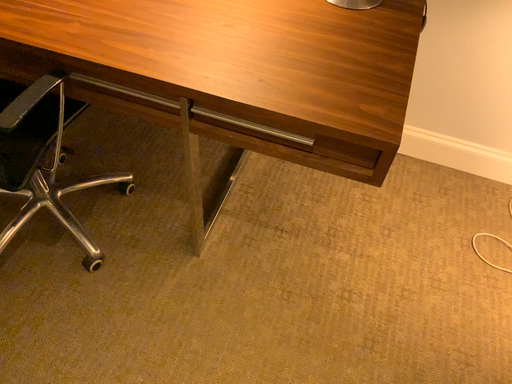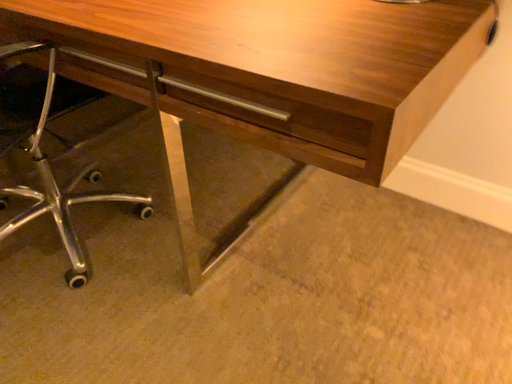
Question: Which way did the camera rotate in the video?

Choices:
 (A) rotated right
 (B) rotated left

Answer: (B)